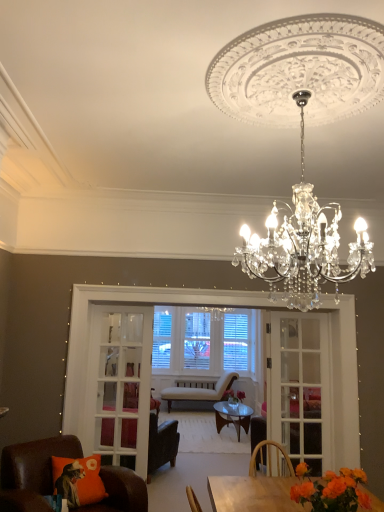
You are a GUI agent. You are given a task and a screenshot of the screen. Output one action in this format:
    pyautogui.click(x=<x>, y=<y>)
    Task: Click on the free space above white glass screen door at center, which is the second screen door in right-to-left order (from a real-world perspective)
    
    Given the screenshot: What is the action you would take?
    pyautogui.click(x=137, y=303)